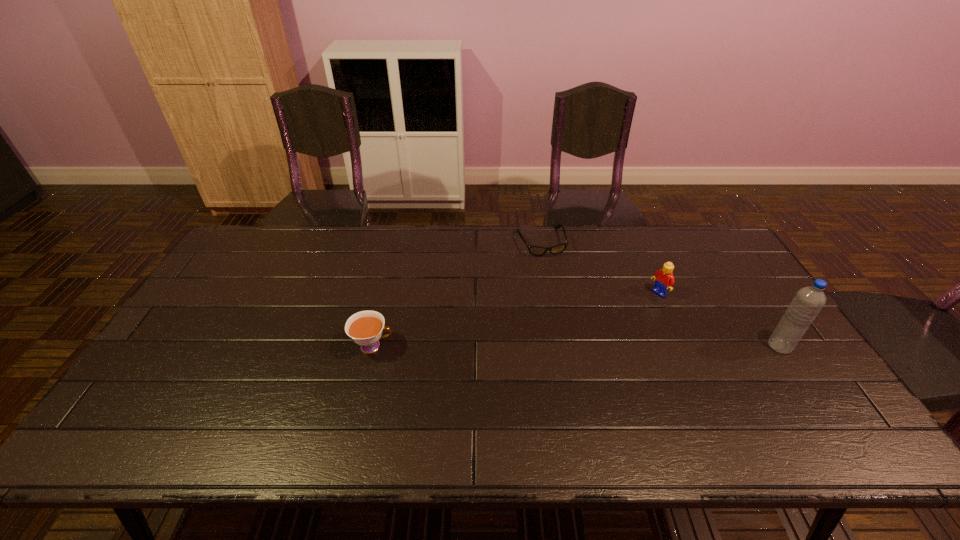
I want to click on teacup, so click(365, 328).

You are a GUI agent. You are given a task and a screenshot of the screen. Output one action in this format:
    pyautogui.click(x=<x>, y=<y>)
    Task: Click on the leftmost object
    This screenshot has height=540, width=960.
    Given the screenshot: What is the action you would take?
    pyautogui.click(x=365, y=328)

You are a GUI agent. You are given a task and a screenshot of the screen. Output one action in this format:
    pyautogui.click(x=<x>, y=<y>)
    Task: Click on the rightmost object
    
    Given the screenshot: What is the action you would take?
    pyautogui.click(x=805, y=306)

The height and width of the screenshot is (540, 960). Find the location of `water bottle`. water bottle is located at coordinates (805, 306).

Where is `the third shortest object`? Image resolution: width=960 pixels, height=540 pixels. the third shortest object is located at coordinates (664, 280).

Where is `Lego`? Lego is located at coordinates (664, 280).

Identify the location of the third object from right to left. The height and width of the screenshot is (540, 960). (557, 249).

Identify the location of spectacles. This screenshot has width=960, height=540. (557, 249).

Where is `vacant space located on the side of the third tallest object with the handle`? vacant space located on the side of the third tallest object with the handle is located at coordinates (468, 346).

You are a GUI agent. You are given a task and a screenshot of the screen. Output one action in this format:
    pyautogui.click(x=<x>, y=<y>)
    Task: Click on the vacant space located 0.390m on the back of the tallest object
    This screenshot has width=960, height=540.
    Given the screenshot: What is the action you would take?
    pyautogui.click(x=717, y=252)